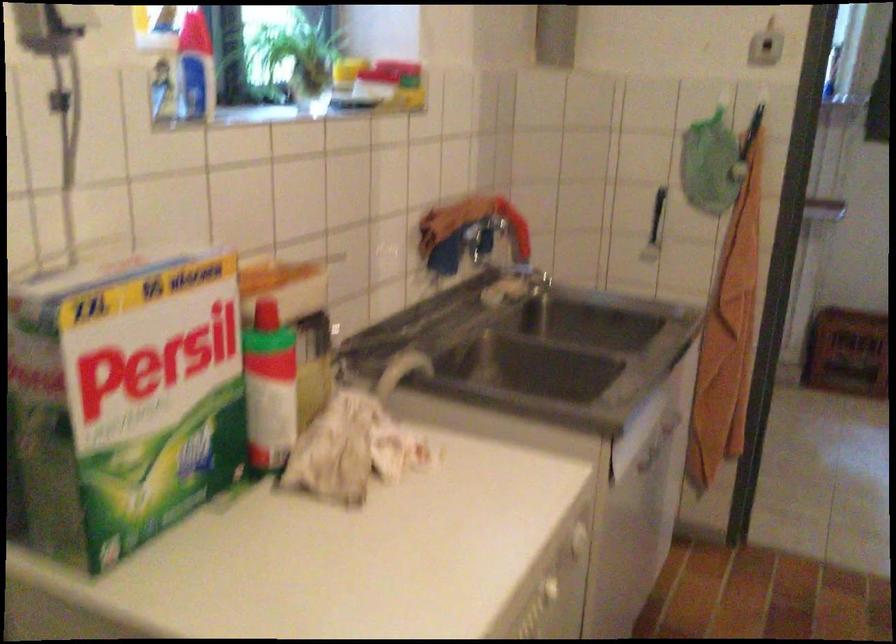
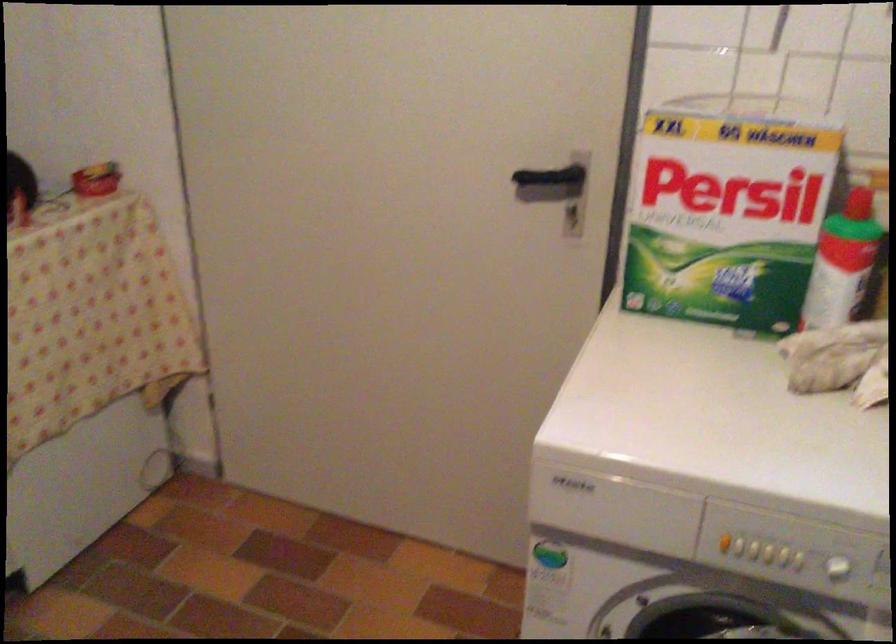
Locate, in the second image, the point that corresponds to pixel 168 389 in the first image.

(728, 210)